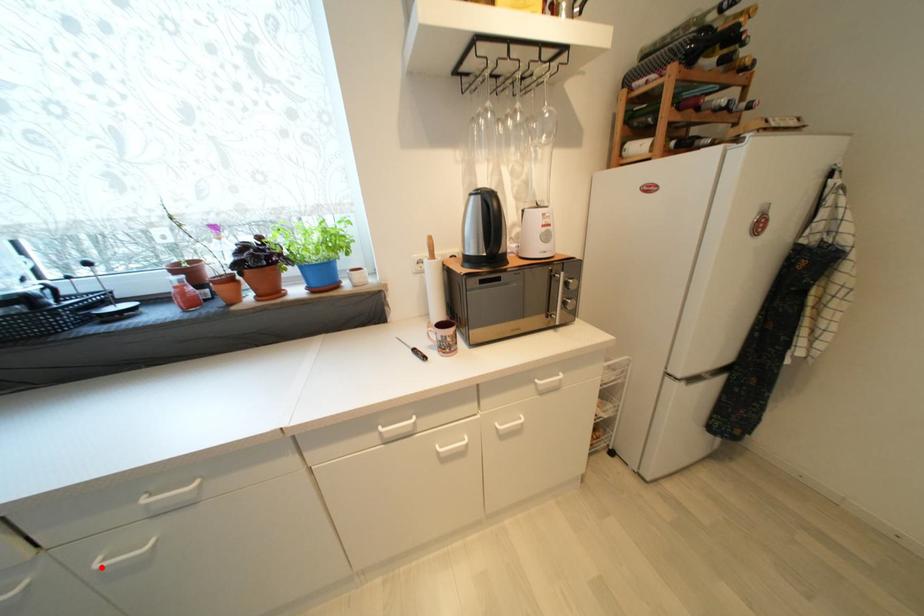
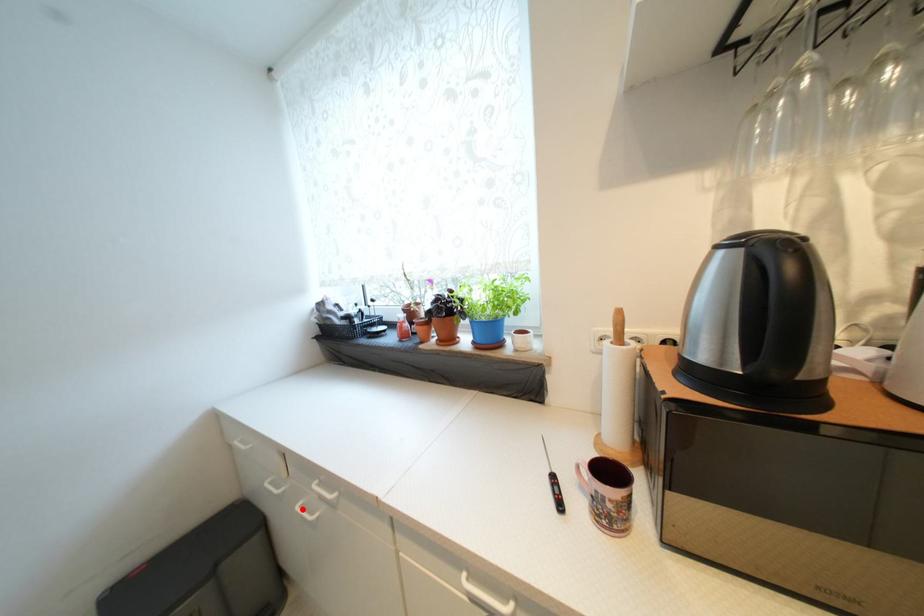
I am providing you with two images of the same scene from different viewpoints. A red point is marked on the first image and another point is marked on the second image. Are the points marked in image1 and image2 representing the same 3D position?

Yes